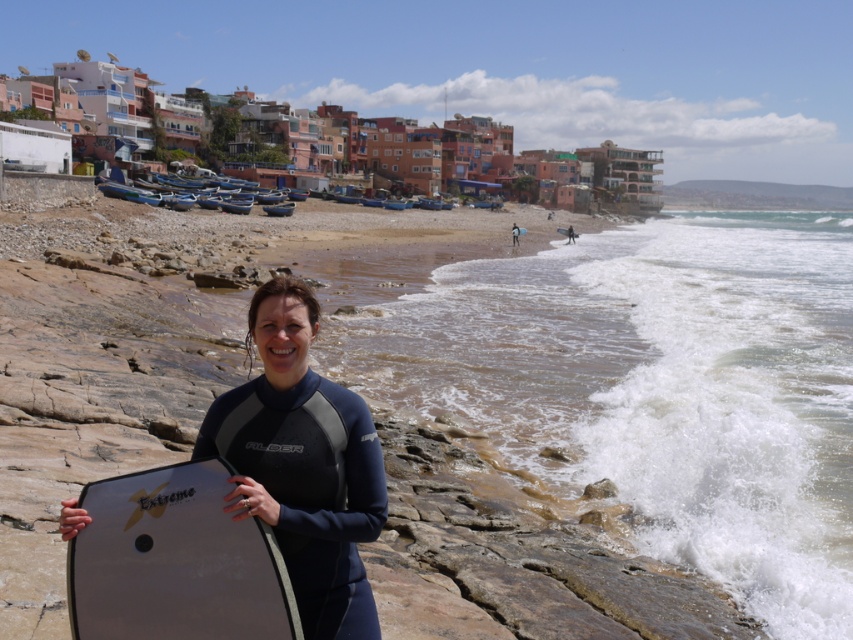
Question: Is matte black surfboard at center bigger than black neoprene wetsuit at center?

Choices:
 (A) no
 (B) yes

Answer: (A)

Question: Where is white frothy water at lower right located in relation to white foam surfboard at lower right in the image?

Choices:
 (A) below
 (B) above

Answer: (A)

Question: Which point appears closest to the camera in this image?

Choices:
 (A) (373, 500)
 (B) (643, 262)
 (C) (112, 564)
 (D) (572, 241)

Answer: (C)

Question: Which of these objects is positioned closest to the white foam surfboard at lower right?

Choices:
 (A) matte black surfboard at center
 (B) white frothy water at lower right
 (C) black neoprene wetsuit at center

Answer: (B)

Question: Does matte black surfboard at center come in front of black neoprene wetsuit at center?

Choices:
 (A) no
 (B) yes

Answer: (B)

Question: Which object appears closest to the camera in this image?

Choices:
 (A) black neoprene wetsuit at center
 (B) matte black surfboard at center

Answer: (B)